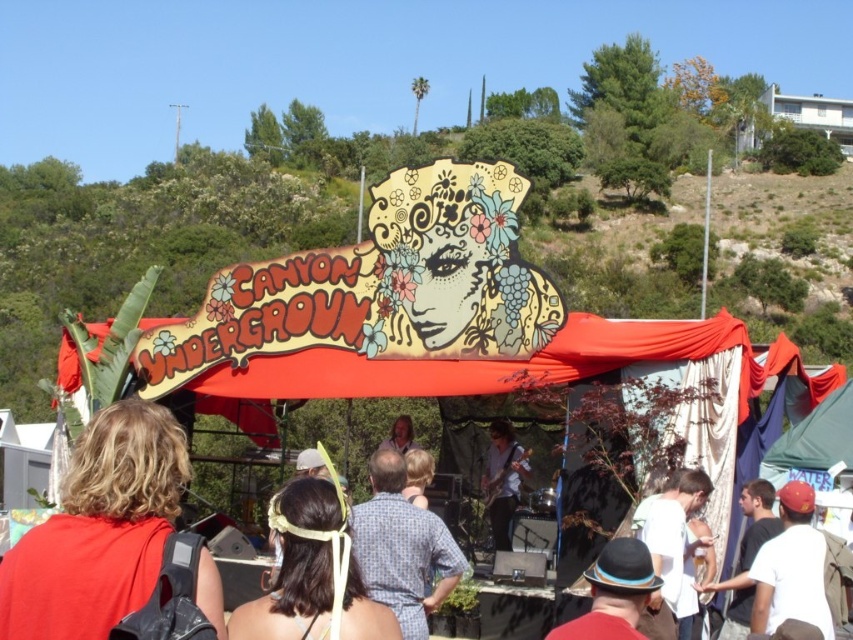
Does blonde hair at center have a greater height compared to light brown hair at center?

No.

Can you confirm if blonde hair at center is smaller than light brown hair at center?

Indeed, blonde hair at center has a smaller size compared to light brown hair at center.

Does point (61, 636) come in front of point (416, 445)?

Yes, it is in front of point (416, 445).

The height and width of the screenshot is (640, 853). What are the coordinates of `blonde hair at center` in the screenshot? It's located at (99, 529).

This screenshot has width=853, height=640. Describe the element at coordinates (402, 547) in the screenshot. I see `blue plaid shirt at center` at that location.

Does blue plaid shirt at center come in front of light brown hair at center?

Yes.

This screenshot has height=640, width=853. Describe the element at coordinates (402, 547) in the screenshot. I see `blue plaid shirt at center` at that location.

Where is `blue plaid shirt at center`? blue plaid shirt at center is located at coordinates (402, 547).

Is black felt hat at center positioned before matte black guitar at center?

Yes, it is.

What do you see at coordinates (614, 593) in the screenshot? I see `black felt hat at center` at bounding box center [614, 593].

Between point (621, 602) and point (489, 480), which one is positioned behind?

Point (489, 480)

At what (x,y) coordinates should I click in order to perform the action: click on black felt hat at center. Please return your answer as a coordinate pair (x, y). Looking at the image, I should click on (614, 593).